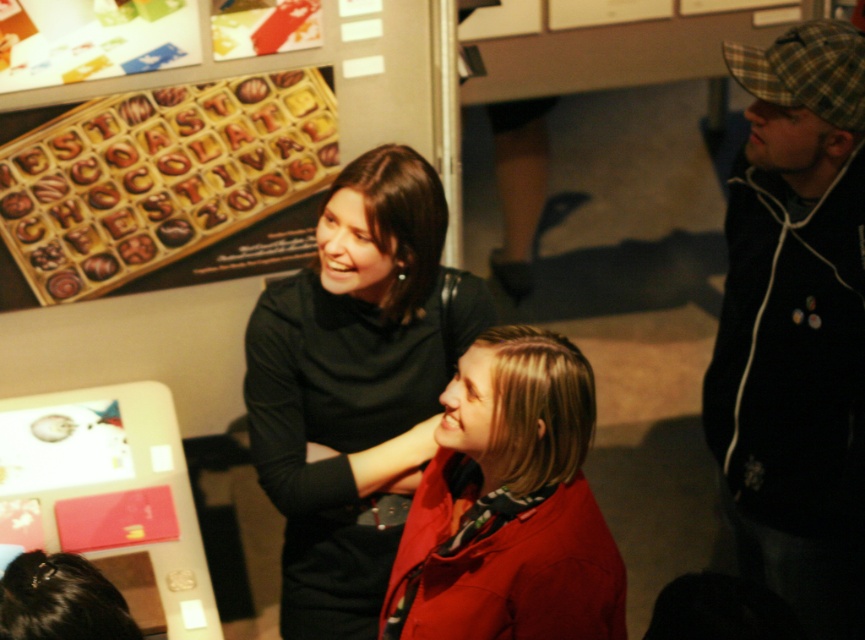
Does black matte dress at center appear under matte red coat at center?

No, black matte dress at center is not below matte red coat at center.

In the scene shown: Between black matte dress at center and matte red coat at center, which one appears on the right side from the viewer's perspective?

matte red coat at center is more to the right.

In order to click on black matte dress at center in this screenshot , I will do `click(356, 385)`.

Does plaid fabric cap at right have a lesser width compared to black matte dress at center?

Indeed, plaid fabric cap at right has a lesser width compared to black matte dress at center.

Does plaid fabric cap at right have a greater height compared to black matte dress at center?

Yes.

Who is more distant from viewer, [843,369] or [420,362]?

Positioned behind is point [420,362].

Where is `plaid fabric cap at right`? plaid fabric cap at right is located at coordinates (796, 326).

Is point (828, 186) less distant than point (516, 356)?

No, it is not.

Between point (831, 627) and point (412, 522), which one is positioned behind?

Point (831, 627)

Which is behind, point (831, 22) or point (497, 564)?

Point (831, 22)

Identify the location of plaid fabric cap at right. 796,326.